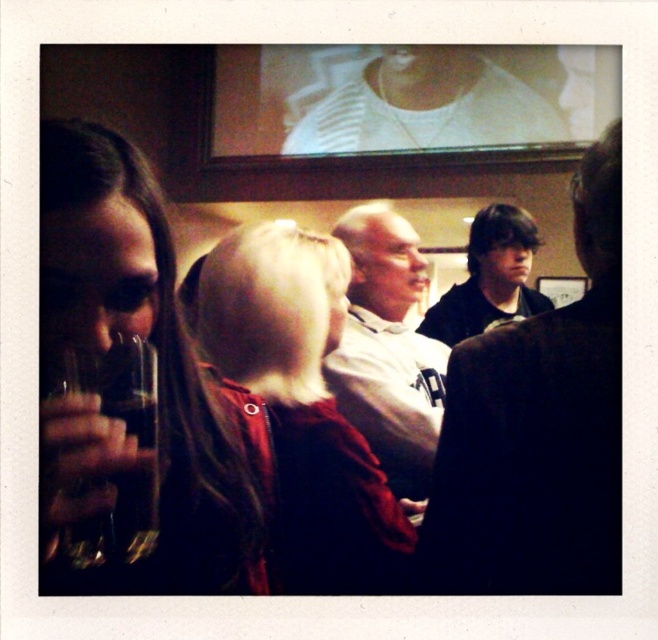
Is point (293, 410) closer to viewer compared to point (405, 333)?

That is True.

Does velvet red coat at center have a smaller size compared to white matte shirt at center?

Incorrect, velvet red coat at center is not smaller in size than white matte shirt at center.

Image resolution: width=658 pixels, height=640 pixels. I want to click on velvet red coat at center, so click(x=299, y=404).

Is matte black hair at left smaller than dark blue shirt at right?

Incorrect, matte black hair at left is not smaller in size than dark blue shirt at right.

Between matte black hair at left and dark blue shirt at right, which one is positioned lower?

Positioned lower is matte black hair at left.

Image resolution: width=658 pixels, height=640 pixels. Identify the location of matte black hair at left. (157, 368).

Which is below, dark blue shirt at right or white matte shirt at center?

Positioned lower is white matte shirt at center.

Which is more to the right, dark blue shirt at right or white matte shirt at center?

dark blue shirt at right

In order to click on dark blue shirt at right in this screenshot , I will do `click(538, 429)`.